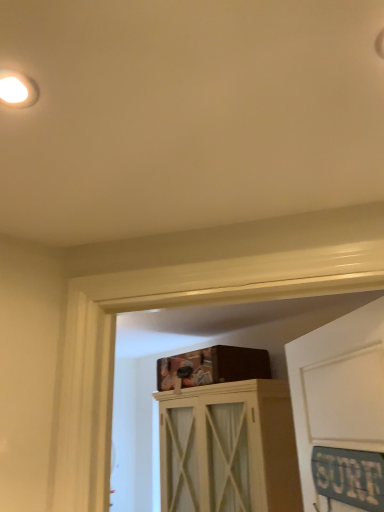
Question: Can you confirm if white matte droplight at upper left is shorter than white wood cabinet at center?

Choices:
 (A) yes
 (B) no

Answer: (A)

Question: From the image's perspective, is white matte droplight at upper left on white wood cabinet at center?

Choices:
 (A) no
 (B) yes

Answer: (B)

Question: Considering the relative positions of white matte droplight at upper left and white wood cabinet at center in the image provided, is white matte droplight at upper left in front of white wood cabinet at center?

Choices:
 (A) no
 (B) yes

Answer: (B)

Question: From a real-world perspective, is white matte droplight at upper left under white wood cabinet at center?

Choices:
 (A) no
 (B) yes

Answer: (A)

Question: Can you confirm if white matte droplight at upper left is wider than white wood cabinet at center?

Choices:
 (A) no
 (B) yes

Answer: (A)

Question: Is white matte droplight at upper left far from white wood cabinet at center?

Choices:
 (A) no
 (B) yes

Answer: (B)

Question: Can you confirm if white wood cabinet at center is bigger than white matte droplight at upper left?

Choices:
 (A) yes
 (B) no

Answer: (A)

Question: From a real-world perspective, is white wood cabinet at center on top of white matte droplight at upper left?

Choices:
 (A) yes
 (B) no

Answer: (B)

Question: Is white wood cabinet at center in contact with white matte droplight at upper left?

Choices:
 (A) no
 (B) yes

Answer: (A)

Question: Is white wood cabinet at center turned away from white matte droplight at upper left?

Choices:
 (A) yes
 (B) no

Answer: (B)

Question: Is white wood cabinet at center further to camera compared to white matte droplight at upper left?

Choices:
 (A) no
 (B) yes

Answer: (B)

Question: From the image's perspective, is white wood cabinet at center located above white matte droplight at upper left?

Choices:
 (A) yes
 (B) no

Answer: (B)

Question: Based on their sizes in the image, would you say white wood cabinet at center is bigger or smaller than white matte droplight at upper left?

Choices:
 (A) big
 (B) small

Answer: (A)